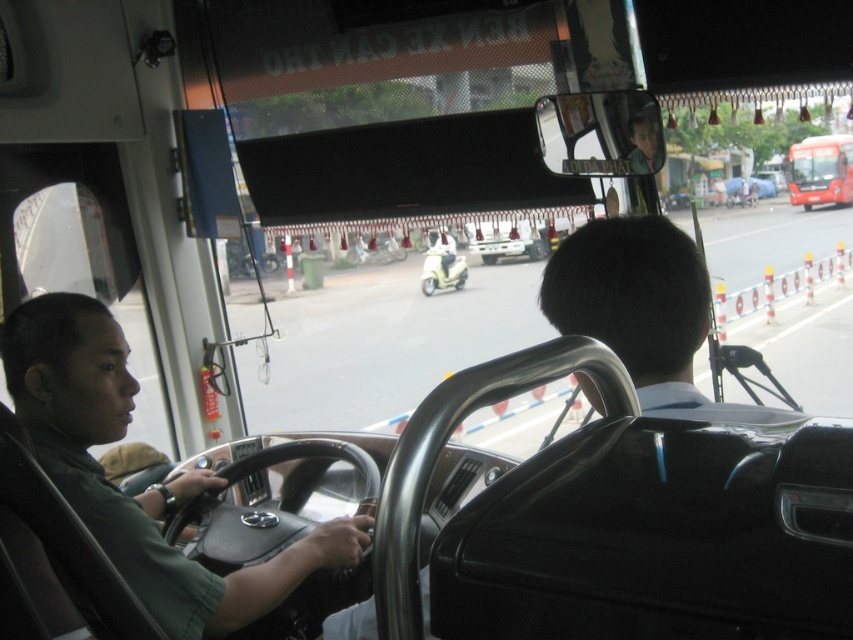
What do you see at coordinates (149, 484) in the screenshot?
I see `green matte shirt at left` at bounding box center [149, 484].

Which is above, green matte shirt at left or red glossy bus at upper right?

red glossy bus at upper right is higher up.

Image resolution: width=853 pixels, height=640 pixels. I want to click on green matte shirt at left, so click(149, 484).